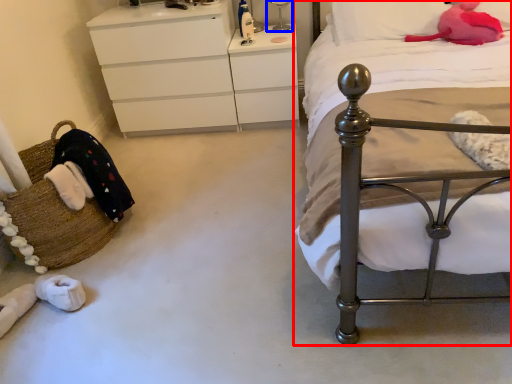
Question: Which object is further to the camera taking this photo, bed (highlighted by a red box) or bedside lamp (highlighted by a blue box)?

Choices:
 (A) bed
 (B) bedside lamp

Answer: (B)